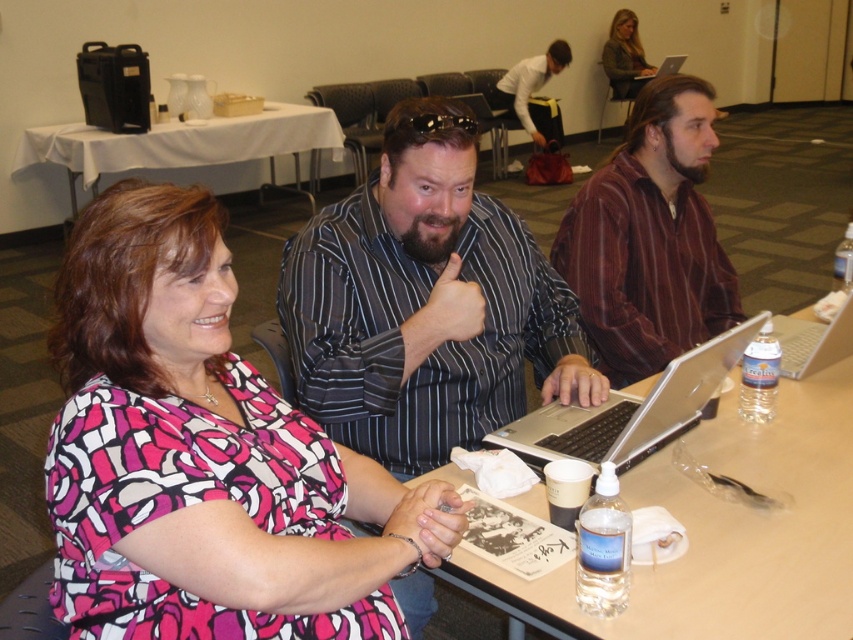
Where is the striped shirt at center located in the image?

The striped shirt at center is located at point 0.475 on the horizontal axis and 0.499 on the vertical axis.

You are organizing a presentation and need to ensure that all materials are visible to the audience. Considering the striped shirt at center and the silver metallic laptop at right, which object is taller and might block the view of the screen?

The striped shirt at center is taller than the silver metallic laptop at right, so it might block the view of the screen.